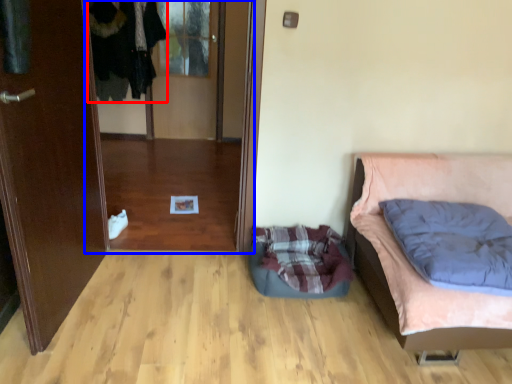
Question: Which of the following is the farthest to the observer, clothing (highlighted by a red box) or glass door (highlighted by a blue box)?

Choices:
 (A) clothing
 (B) glass door

Answer: (A)